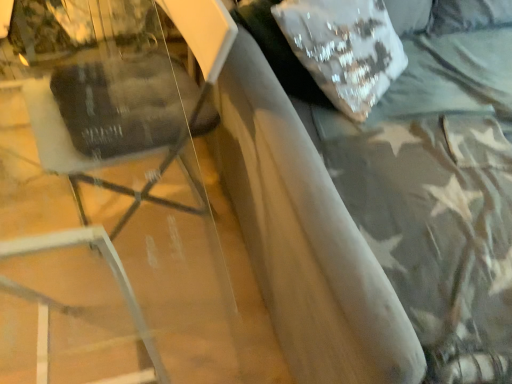
Question: Does matte black swivel chair at left have a greater width compared to suede-like gray bed at upper right?

Choices:
 (A) yes
 (B) no

Answer: (B)

Question: From the image's perspective, would you say matte black swivel chair at left is positioned over suede-like gray bed at upper right?

Choices:
 (A) yes
 (B) no

Answer: (B)

Question: Can you confirm if matte black swivel chair at left is thinner than suede-like gray bed at upper right?

Choices:
 (A) yes
 (B) no

Answer: (A)

Question: Can you confirm if matte black swivel chair at left is smaller than suede-like gray bed at upper right?

Choices:
 (A) yes
 (B) no

Answer: (A)

Question: Does matte black swivel chair at left turn towards suede-like gray bed at upper right?

Choices:
 (A) yes
 (B) no

Answer: (B)

Question: In the image, is suede-like gray bed at upper right positioned in front of or behind white sequined pillow at upper right?

Choices:
 (A) front
 (B) behind

Answer: (A)

Question: From the image's perspective, is suede-like gray bed at upper right positioned above or below white sequined pillow at upper right?

Choices:
 (A) above
 (B) below

Answer: (B)

Question: In terms of width, does suede-like gray bed at upper right look wider or thinner when compared to white sequined pillow at upper right?

Choices:
 (A) wide
 (B) thin

Answer: (A)

Question: Is suede-like gray bed at upper right inside or outside of white sequined pillow at upper right?

Choices:
 (A) inside
 (B) outside

Answer: (B)

Question: In terms of height, does white sequined pillow at upper right look taller or shorter compared to matte black swivel chair at left?

Choices:
 (A) tall
 (B) short

Answer: (B)

Question: In terms of size, does white sequined pillow at upper right appear bigger or smaller than matte black swivel chair at left?

Choices:
 (A) small
 (B) big

Answer: (A)

Question: Is white sequined pillow at upper right to the left or to the right of matte black swivel chair at left in the image?

Choices:
 (A) left
 (B) right

Answer: (B)

Question: Is point (309, 29) positioned closer to the camera than point (129, 69)?

Choices:
 (A) farther
 (B) closer

Answer: (A)

Question: From a real-world perspective, is white sequined pillow at upper right physically located above or below suede-like gray bed at upper right?

Choices:
 (A) above
 (B) below

Answer: (A)

Question: Is white sequined pillow at upper right wider or thinner than suede-like gray bed at upper right?

Choices:
 (A) thin
 (B) wide

Answer: (A)